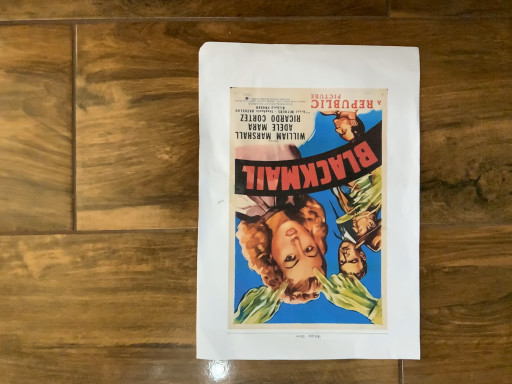
What do you see at coordinates (308, 202) in the screenshot? I see `vibrant paper poster at center` at bounding box center [308, 202].

What is the approximate height of vibrant paper poster at center?

0.59 inches.

This screenshot has height=384, width=512. Identify the location of vibrant paper poster at center. (308, 202).

Where is `vibrant paper poster at center`? This screenshot has height=384, width=512. vibrant paper poster at center is located at coordinates (308, 202).